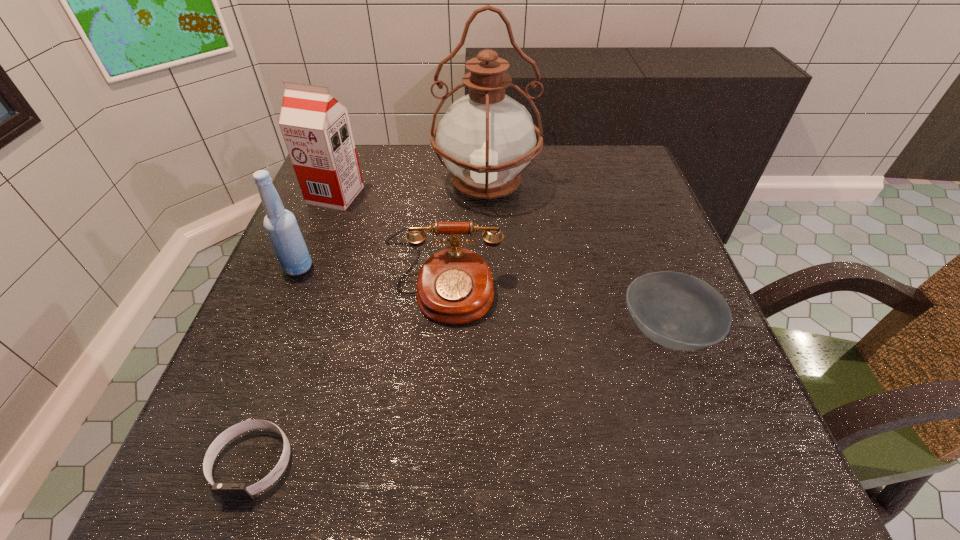
Find the location of a particular element. This screenshot has width=960, height=540. vacant area that lies between the third shortest object and the rightmost object is located at coordinates (x=556, y=313).

You are a GUI agent. You are given a task and a screenshot of the screen. Output one action in this format:
    pyautogui.click(x=<x>, y=<y>)
    Task: Click on the free point between the bowl and the tallest object
    
    Given the screenshot: What is the action you would take?
    pyautogui.click(x=576, y=258)

Image resolution: width=960 pixels, height=540 pixels. In order to click on vacant space in between the rightmost object and the tallest object in this screenshot , I will do point(576,258).

The image size is (960, 540). Find the location of `free spot between the shortest object and the oil lamp`. free spot between the shortest object and the oil lamp is located at coordinates (370, 323).

The height and width of the screenshot is (540, 960). Find the location of `object identified as the second closest to the bowl`. object identified as the second closest to the bowl is located at coordinates (486, 138).

Select which object appears as the closest to the third shortest object. Please provide its 2D coordinates. Your answer should be formatted as a tuple, i.e. [(x, y)], where the tuple contains the x and y coordinates of a point satisfying the conditions above.

[(486, 138)]

You are a GUI agent. You are given a task and a screenshot of the screen. Output one action in this format:
    pyautogui.click(x=<x>, y=<y>)
    Task: Click on the free space in the image that satisfies the following two spatial constraints: 1. on the back side of the tallest object; 2. on the right side of the fourth shortest object
    
    Given the screenshot: What is the action you would take?
    pyautogui.click(x=332, y=184)